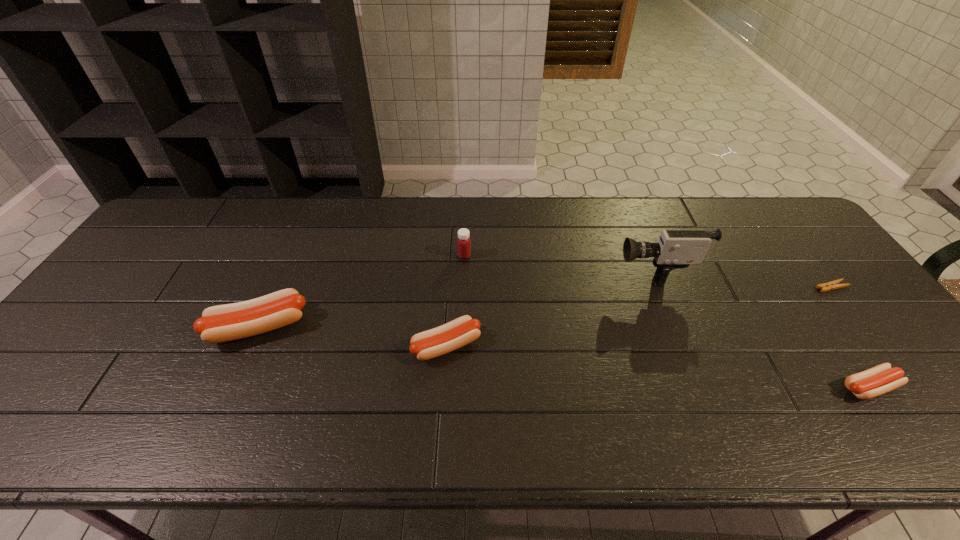
This screenshot has width=960, height=540. In order to click on free spot between the third shortest object and the rightmost sausage in this screenshot , I will do `click(658, 367)`.

I want to click on vacant point located between the shortest object and the rightmost sausage, so click(x=850, y=337).

Locate an element on the screen. vacant area between the fourth object from left to right and the leftmost object is located at coordinates (455, 298).

The height and width of the screenshot is (540, 960). What are the coordinates of `free point between the second sausage from left to right and the shortest object` in the screenshot? It's located at (639, 316).

Locate an element on the screen. vacant area that lies between the second sausage from right to left and the shortest object is located at coordinates (639, 316).

The image size is (960, 540). In order to click on free spot between the clothespin and the medicine in this screenshot , I will do `click(648, 271)`.

Find the location of a particular element. free space between the second sausage from left to right and the leftmost sausage is located at coordinates (352, 336).

The width and height of the screenshot is (960, 540). I want to click on vacant area that lies between the fourth object from left to right and the third tallest object, so click(455, 298).

Choose which object is the third nearest neighbor to the clothespin. Please provide its 2D coordinates. Your answer should be formatted as a tuple, i.e. [(x, y)], where the tuple contains the x and y coordinates of a point satisfying the conditions above.

[(457, 333)]

Image resolution: width=960 pixels, height=540 pixels. What are the coordinates of `object that is the closest one to the second tallest object` in the screenshot? It's located at (457, 333).